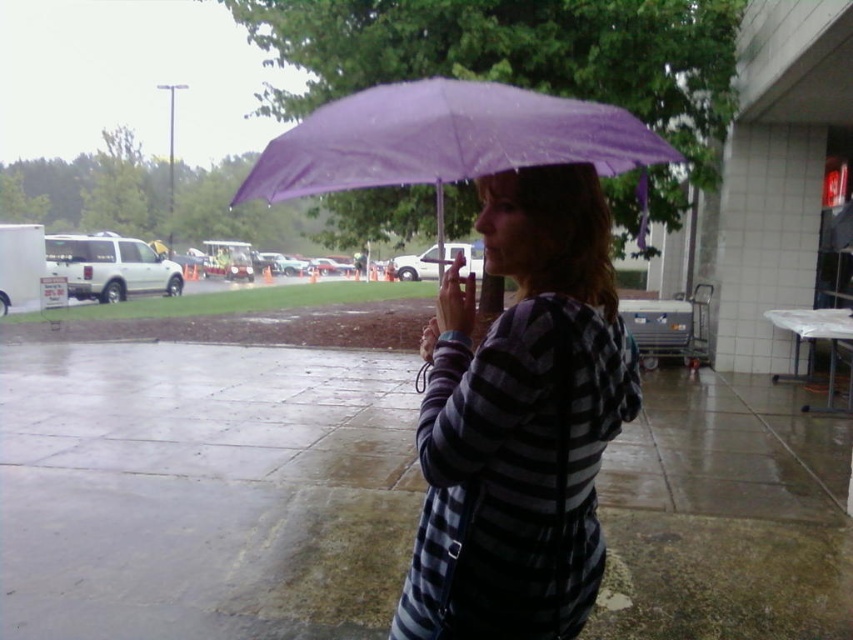
Question: Does striped fabric hoodie at center appear on the right side of purple matte umbrella at center?

Choices:
 (A) no
 (B) yes

Answer: (B)

Question: Does striped fabric hoodie at center appear on the left side of purple matte umbrella at center?

Choices:
 (A) yes
 (B) no

Answer: (B)

Question: Which point is farther from the camera taking this photo?

Choices:
 (A) (628, 118)
 (B) (538, 168)

Answer: (A)

Question: Among these objects, which one is nearest to the camera?

Choices:
 (A) purple matte umbrella at center
 (B) striped fabric hoodie at center

Answer: (A)

Question: Is striped fabric hoodie at center further to camera compared to purple matte umbrella at center?

Choices:
 (A) yes
 (B) no

Answer: (A)